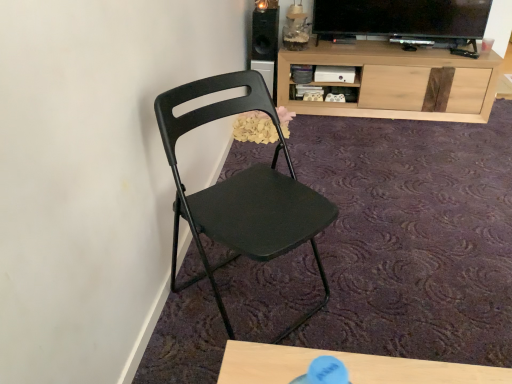
Question: From the image's perspective, is light wood cabinet at upper right above or below matte black folding chair at center?

Choices:
 (A) below
 (B) above

Answer: (B)

Question: Relative to matte black folding chair at center, is light wood cabinet at upper right in front or behind?

Choices:
 (A) front
 (B) behind

Answer: (B)

Question: Based on their relative distances, which object is farther from the matte black folding chair at center?

Choices:
 (A) black matte speaker at upper center
 (B) light wood cabinet at upper right

Answer: (A)

Question: Which is farther from the black matte speaker at upper center?

Choices:
 (A) light wood cabinet at upper right
 (B) matte black folding chair at center

Answer: (B)